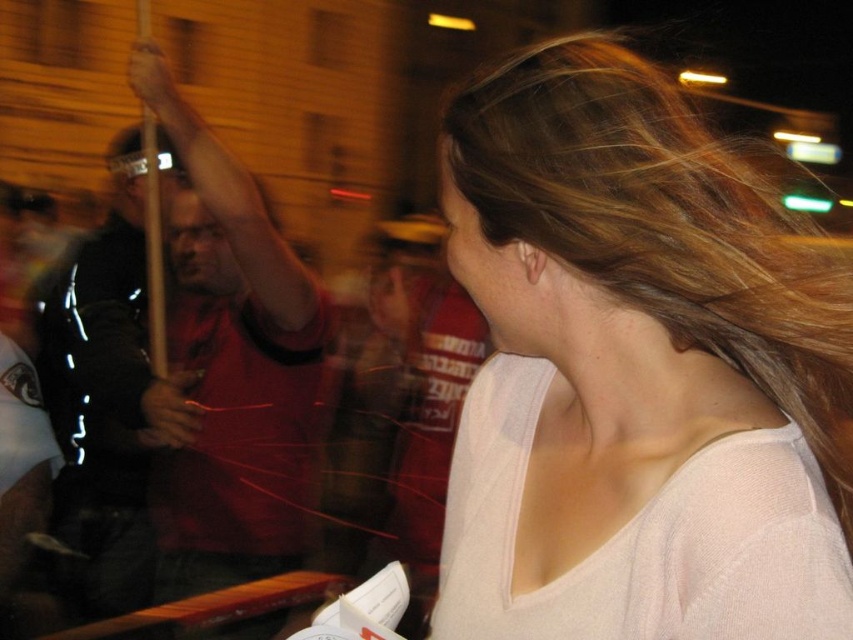
Between point (637, 458) and point (283, 428), which one is positioned in front?

Point (637, 458) is more forward.

The height and width of the screenshot is (640, 853). What do you see at coordinates (637, 372) in the screenshot?
I see `light pink sweater at center` at bounding box center [637, 372].

Is point (599, 468) more distant than point (155, 518)?

No, it is in front of (155, 518).

Identify the location of light pink sweater at center. (637, 372).